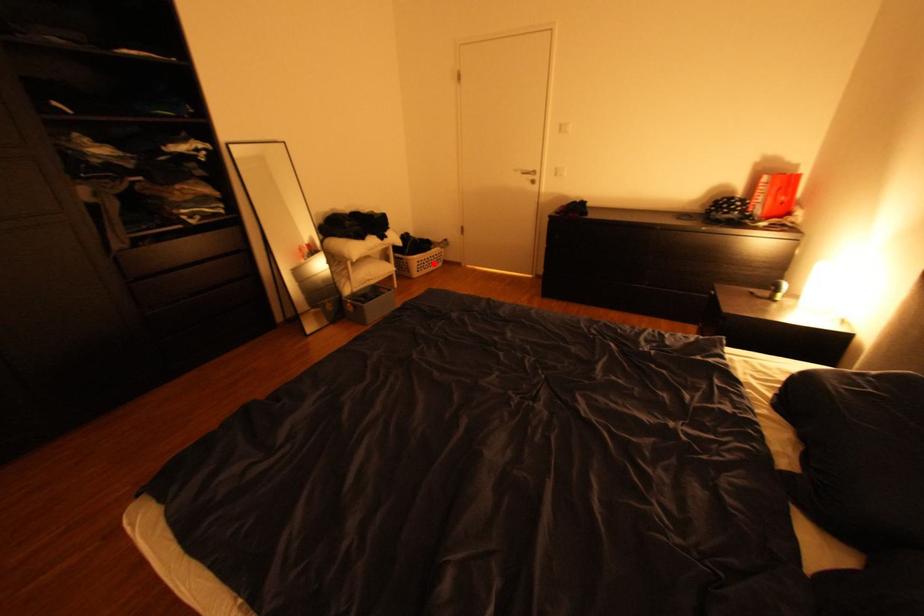
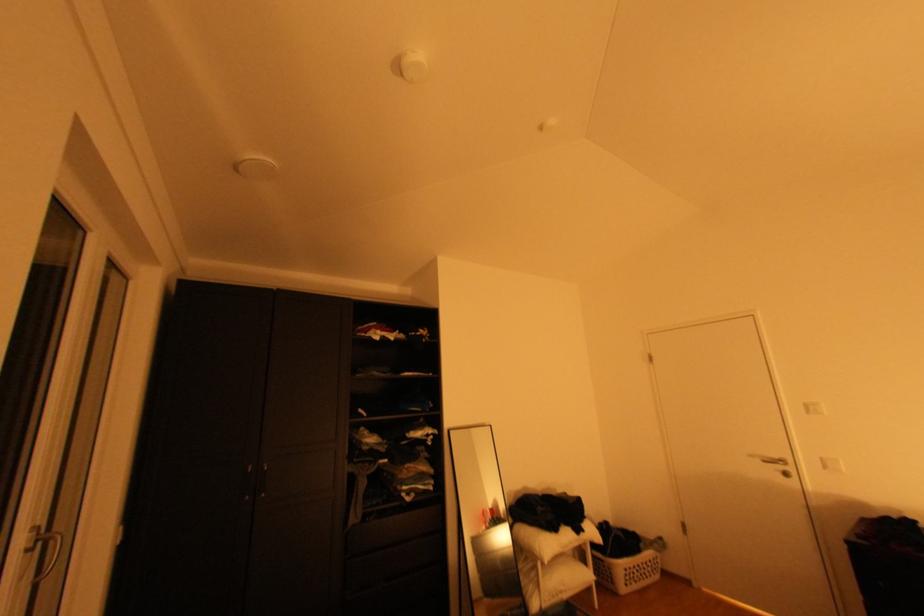
Question: I am providing you with two images of the same scene from different viewpoints. Image1 has a red point marked. In image2, the corresponding 3D location appears at what relative position? Reply with the corresponding letter.

Choices:
 (A) Closer
 (B) Farther

Answer: (B)